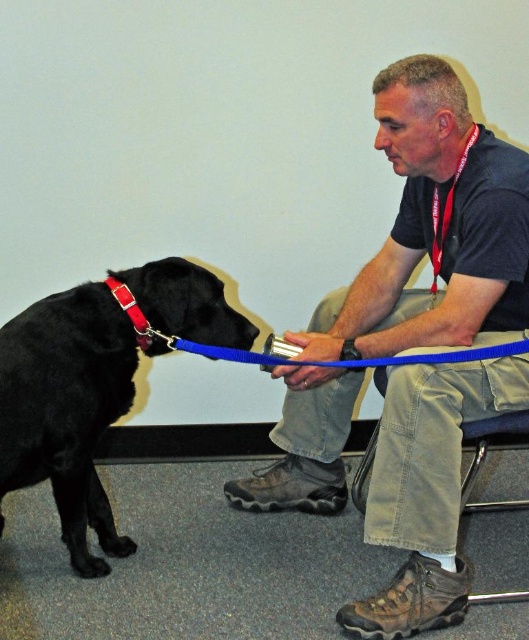
You are standing in the room and see two points marked in the scene. Which point is closer to you, point (88, 387) or point (498, 344)?

Point (88, 387) is further to the viewer than point (498, 344), so point (498, 344) is closer to you.

Looking at this image, what object is located at the coordinates point [67,408]?

The point [67,408] corresponds to the black matte dog at left.